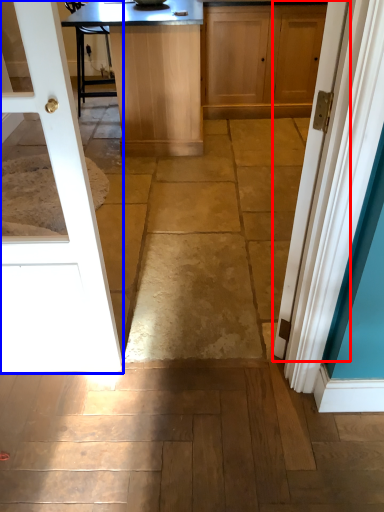
Question: Which object appears farthest to the camera in this image, door (highlighted by a red box) or door (highlighted by a blue box)?

Choices:
 (A) door
 (B) door

Answer: (A)